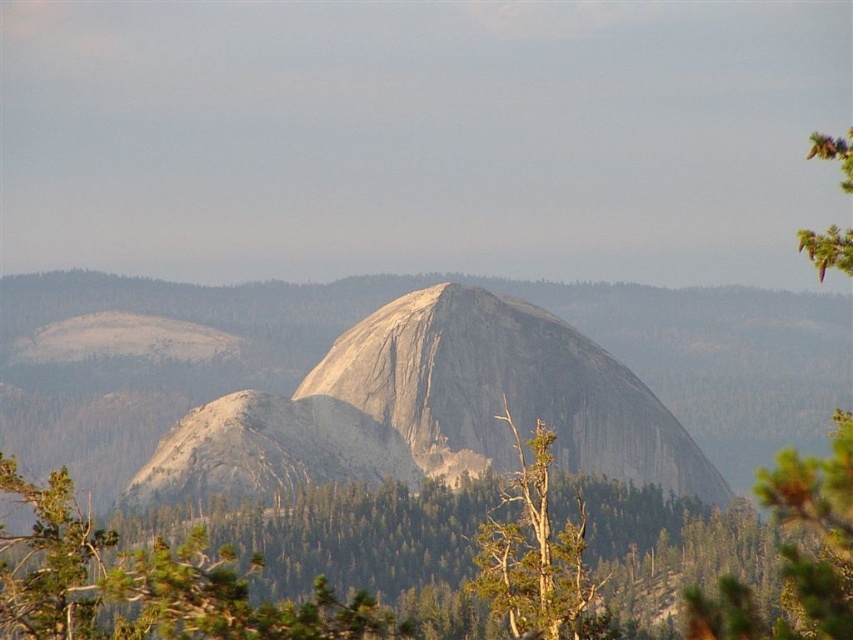
Question: Which of the following is the closest to the observer?

Choices:
 (A) (703, 468)
 (B) (73, 609)

Answer: (B)

Question: Is green leafy tree at center to the right of green leafy tree at upper right from the viewer's perspective?

Choices:
 (A) no
 (B) yes

Answer: (A)

Question: Is green leafy tree at center closer to the viewer compared to green textured tree at center?

Choices:
 (A) yes
 (B) no

Answer: (A)

Question: Which of the following is the farthest from the observer?

Choices:
 (A) gray rock formation at center
 (B) green leafy tree at upper right
 (C) green textured tree at center

Answer: (A)

Question: Does gray rock formation at center have a smaller size compared to green leafy tree at center?

Choices:
 (A) no
 (B) yes

Answer: (B)

Question: Which of the following is the farthest from the observer?

Choices:
 (A) green leafy tree at upper right
 (B) green leafy tree at center

Answer: (A)